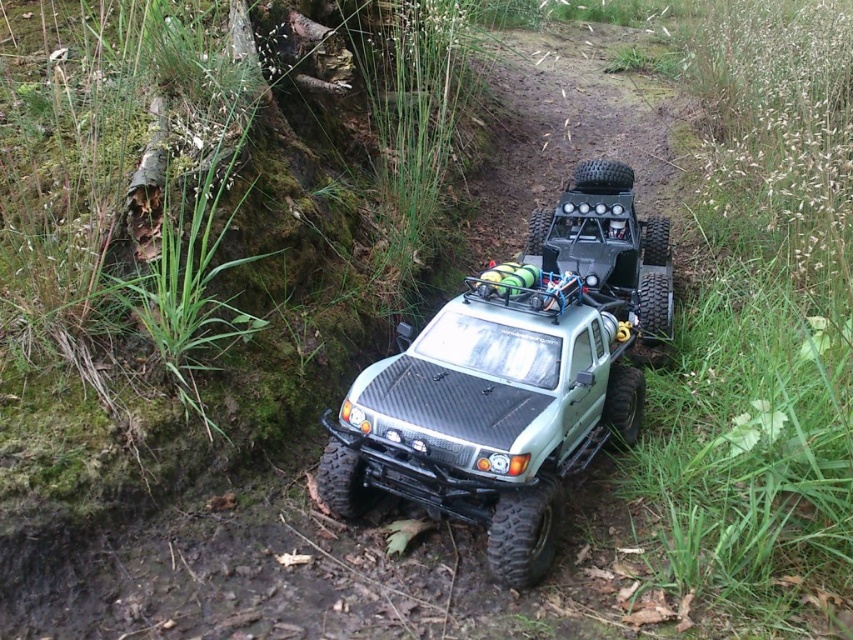
Question: Which point is farther to the camera?

Choices:
 (A) (631, 218)
 (B) (599, 243)

Answer: (A)

Question: Does green matte truck at center have a greater width compared to matte black jeep at center?

Choices:
 (A) no
 (B) yes

Answer: (B)

Question: Does green matte truck at center have a lesser width compared to matte black jeep at center?

Choices:
 (A) no
 (B) yes

Answer: (A)

Question: Which point is farther to the camera?

Choices:
 (A) (604, 349)
 (B) (619, 284)

Answer: (B)

Question: Can you confirm if green matte truck at center is positioned to the right of matte black jeep at center?

Choices:
 (A) yes
 (B) no

Answer: (B)